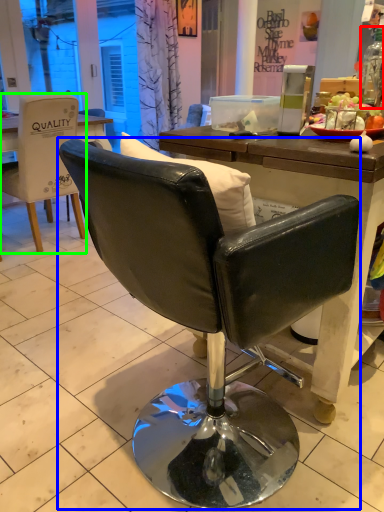
Question: Considering the real-world distances, which object is closest to bottle (highlighted by a red box)? chair (highlighted by a blue box) or chair (highlighted by a green box).

Choices:
 (A) chair
 (B) chair

Answer: (A)